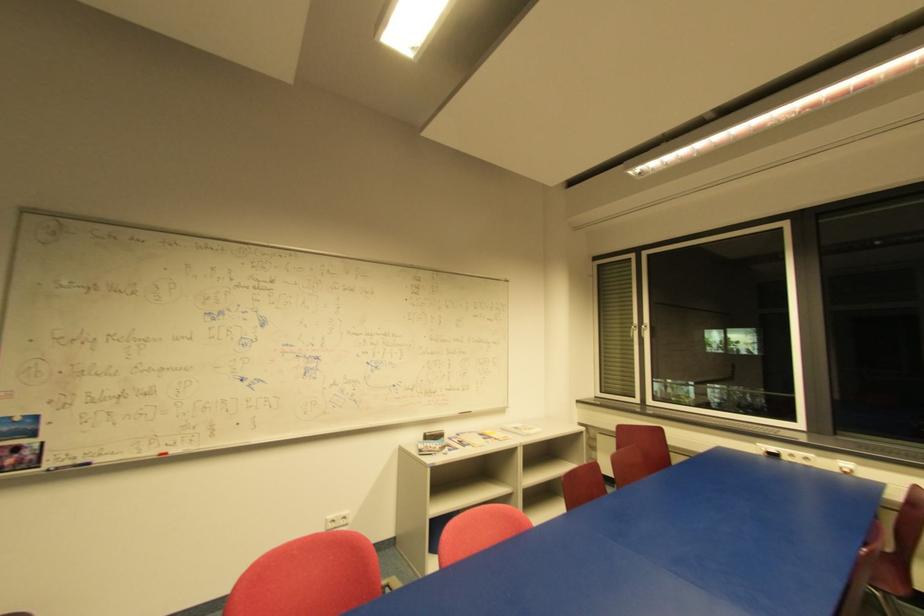
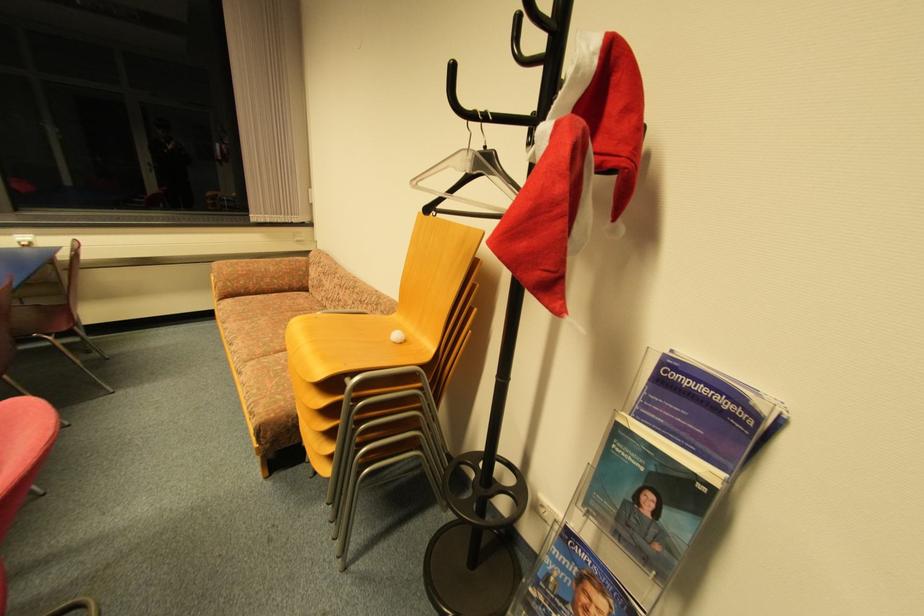
In the scene shown: The first image is from the beginning of the video and the second image is from the end. How did the camera likely rotate when shooting the video?

The camera's rotation is toward right-down.